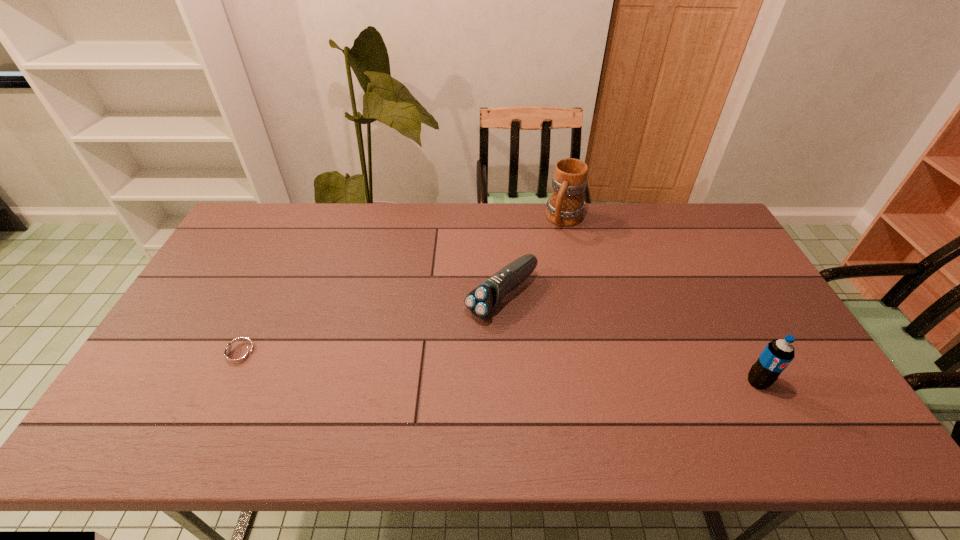
Locate an element on the screen. This screenshot has width=960, height=540. vacant spot on the desktop that is between the shortest object and the third shortest object and is positioned on the side of the mug with the handle is located at coordinates (488, 368).

You are a GUI agent. You are given a task and a screenshot of the screen. Output one action in this format:
    pyautogui.click(x=<x>, y=<y>)
    Task: Click on the vacant space on the desktop that is between the watch and the soda bottle and is positioned on the head of the electric shaver
    
    Given the screenshot: What is the action you would take?
    pyautogui.click(x=420, y=364)